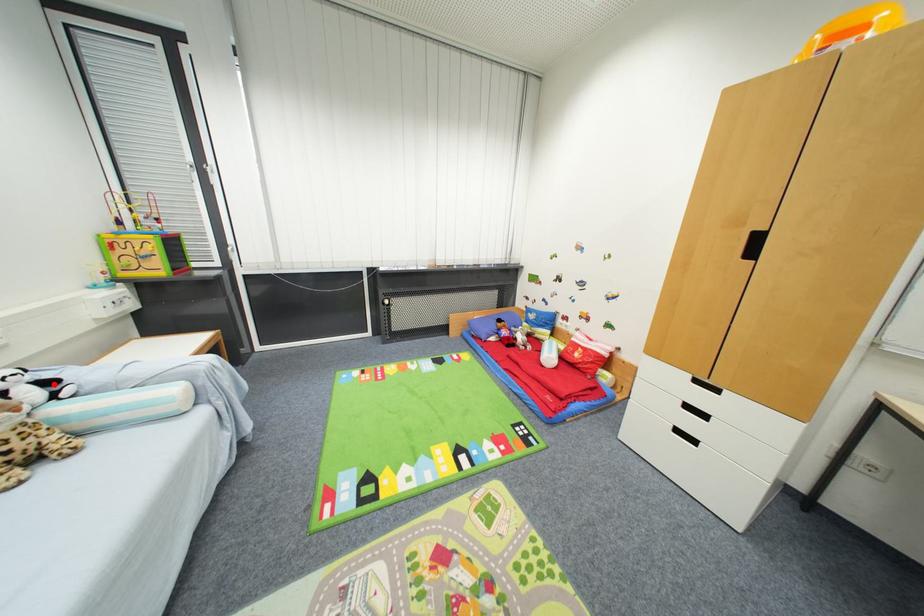
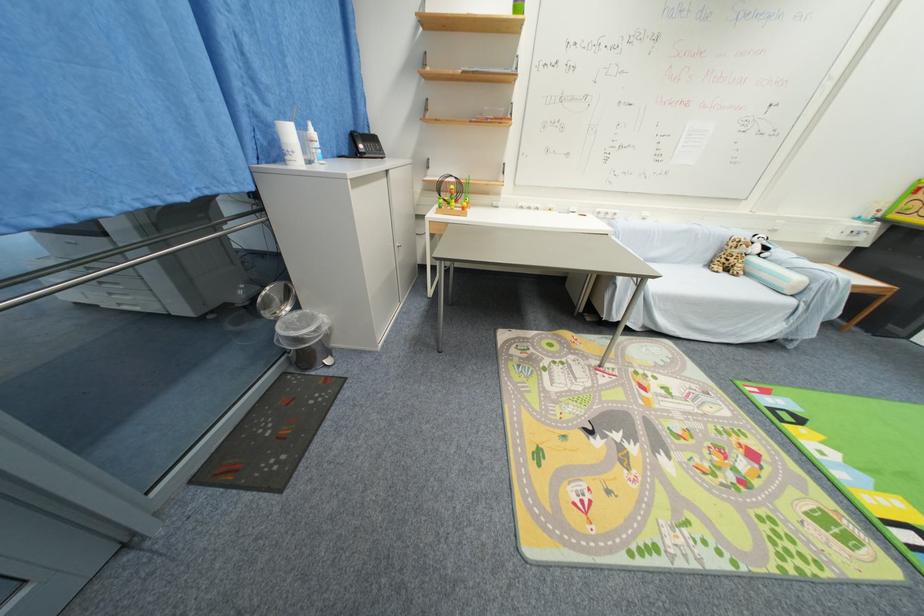
Question: I am providing you with two images of the same scene from different viewpoints. In image1, a red point is highlighted. Considering the same 3D point in image2, which of the following is correct?

Choices:
 (A) It is closer
 (B) It is farther

Answer: (A)